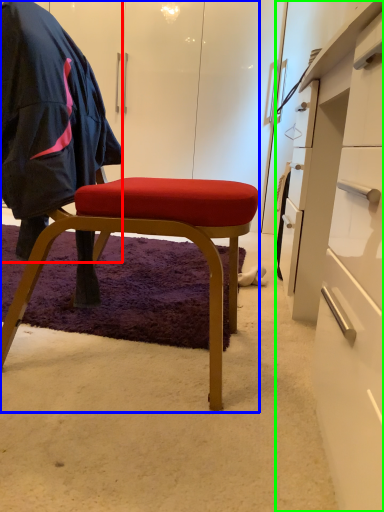
Question: Which object is the closest to the clothing (highlighted by a red box)? Choose among these: chair (highlighted by a blue box) or desk (highlighted by a green box).

Choices:
 (A) chair
 (B) desk

Answer: (A)